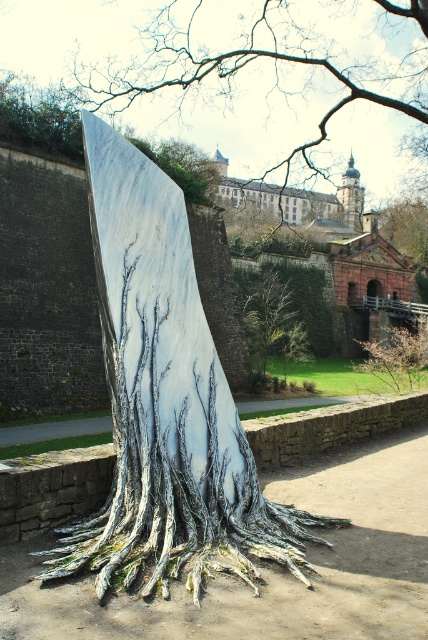
You are an art curator planning to display both the white marble tree at center and the smooth bark tree at center in an exhibition. Given their sizes, which one should be placed in a larger display area to accommodate its size?

The white marble tree at center is larger in size than the smooth bark tree at center, so it should be placed in a larger display area to accommodate its size.

You are standing in the courtyard and want to take a photo of the sculpture. Where should you position yourself to ensure the white marble tree at center is fully visible without any obstruction from the historic stone wall?

The white marble tree at center is located at point (275, 60), so positioning yourself in the courtyard facing towards that coordinate will ensure the sculpture is fully visible without obstruction from the historic stone wall.

You are standing in front of the sculpture and want to take a photo of both the white marble tree trunk at center and the green leafy tree at center. Which one should you position to the left side of your camera frame to include both in the photo?

You should position the white marble tree trunk at center to the left side of your camera frame since it is already to the left of the green leafy tree at center in the scene.